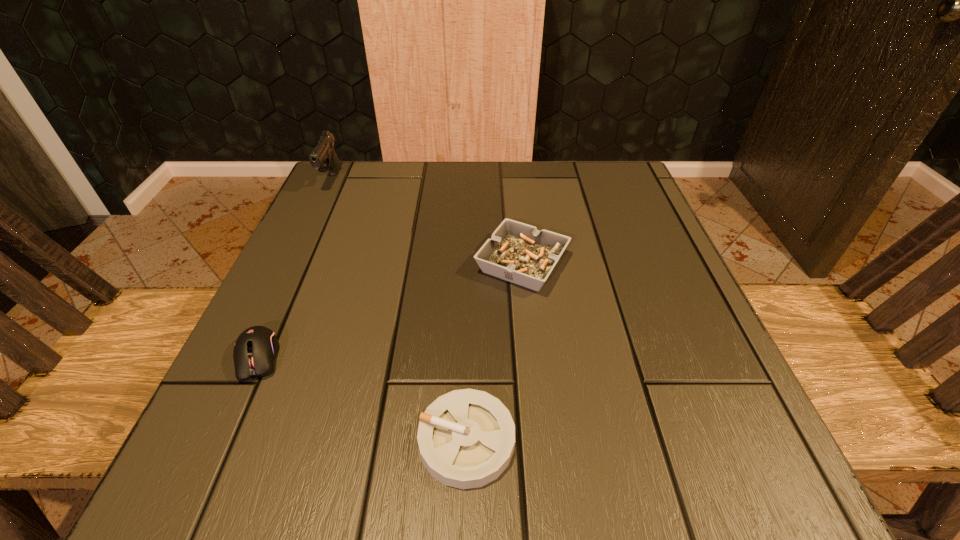
Locate an element on the screen. The image size is (960, 540). pistol is located at coordinates (323, 157).

Locate an element on the screen. The width and height of the screenshot is (960, 540). the farthest object is located at coordinates click(323, 157).

In order to click on the farther ashtray in this screenshot , I will do `click(517, 252)`.

Image resolution: width=960 pixels, height=540 pixels. Find the location of `the second farthest object`. the second farthest object is located at coordinates (517, 252).

Where is `the second nearest object`? the second nearest object is located at coordinates (255, 349).

This screenshot has height=540, width=960. I want to click on the shortest object, so click(x=466, y=438).

I want to click on the nearest object, so click(x=466, y=438).

This screenshot has height=540, width=960. I want to click on vacant space located at the barrel of the farthest object, so click(x=318, y=207).

Find the location of a particular element. free space located on the front of the second farthest object is located at coordinates (539, 413).

Where is `vacant space located on the right of the computer mouse`? This screenshot has width=960, height=540. vacant space located on the right of the computer mouse is located at coordinates (372, 357).